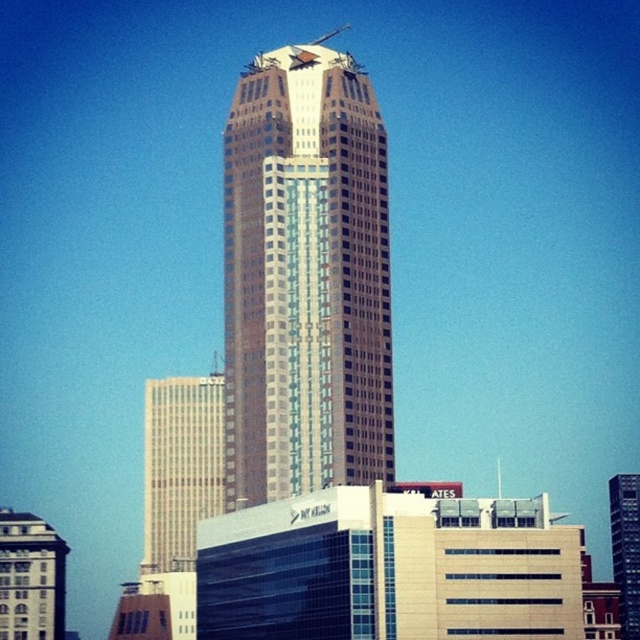
Question: Estimate the real-world distances between objects in this image. Which object is farther from the beige glass building at left?

Choices:
 (A) glassy steel skyscraper at center
 (B) glassy reflective skyscraper at center

Answer: (B)

Question: Which point is closer to the camera?

Choices:
 (A) beige glass building at left
 (B) glassy reflective skyscraper at center

Answer: (B)

Question: Does beige glass building at left have a smaller size compared to glassy reflective skyscraper at center?

Choices:
 (A) yes
 (B) no

Answer: (A)

Question: Estimate the real-world distances between objects in this image. Which object is farther from the white marble building at lower left?

Choices:
 (A) glassy reflective skyscraper at center
 (B) glassy steel skyscraper at center
 (C) beige glass building at left

Answer: (A)

Question: Does white marble building at lower left have a lesser width compared to glassy reflective skyscraper at center?

Choices:
 (A) no
 (B) yes

Answer: (B)

Question: Considering the relative positions of glassy steel skyscraper at center and beige glass building at left in the image provided, where is glassy steel skyscraper at center located with respect to beige glass building at left?

Choices:
 (A) below
 (B) above

Answer: (B)